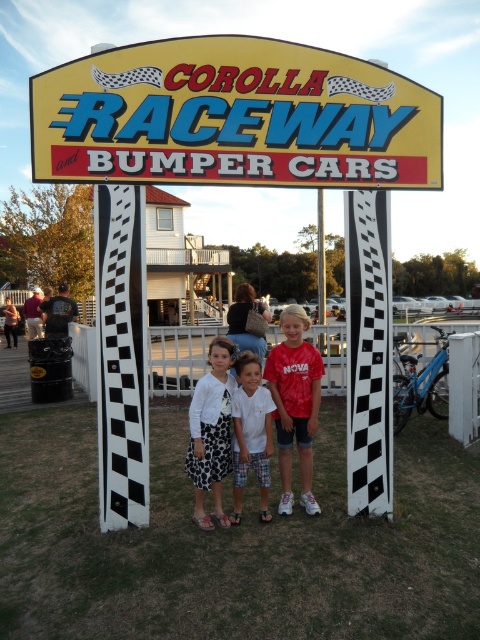
You are a photographer trying to capture the children and the sign in a single shot. The yellow plastic sign at upper center and the white cotton shirt at center are both in your frame. Considering their sizes, which object appears bigger in the photo?

The yellow plastic sign at upper center appears bigger in the photo because its width is larger than that of the white cotton shirt at center.

You are at the COROLLA RACEWAY and BUMPER CARS sign. There is a yellow plastic sign at upper center located at point (233, 116). If you want to touch this sign, should you move towards the left or the right?

The yellow plastic sign at upper center is located at point (233, 116), which is to the left side of the COROLLA RACEWAY and BUMPER CARS sign. Therefore, you should move towards the left to reach it.

You are at the COROLLA RACEWAY and BUMPER CARS area and want to locate the white textured sweater at center. Which direction should you look relative to the yellow plastic sign at upper center?

To locate the white textured sweater at center, you should look to the left of the yellow plastic sign at upper center since the yellow plastic sign at upper center is positioned to the right of the white textured sweater at center.